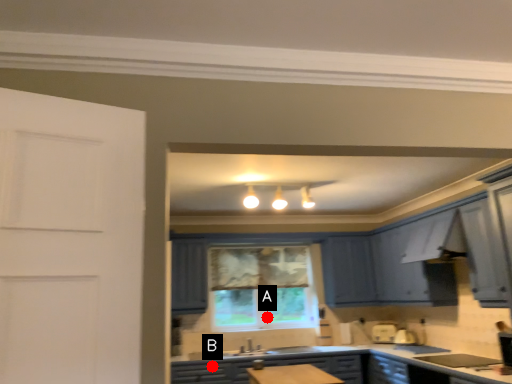
Question: Two points are circled on the image, labeled by A and B beside each circle. Which point is farther to the camera?

Choices:
 (A) A is further
 (B) B is further

Answer: (A)